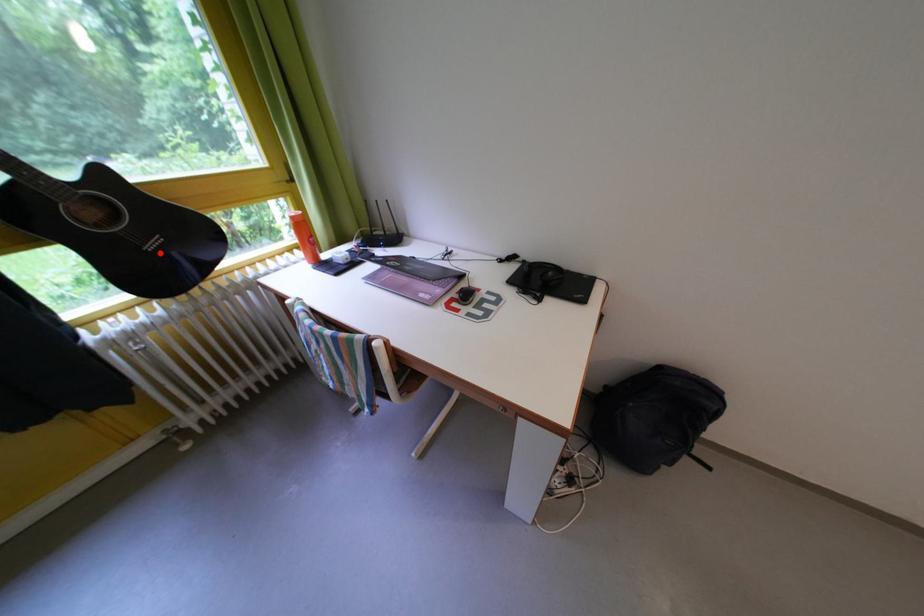
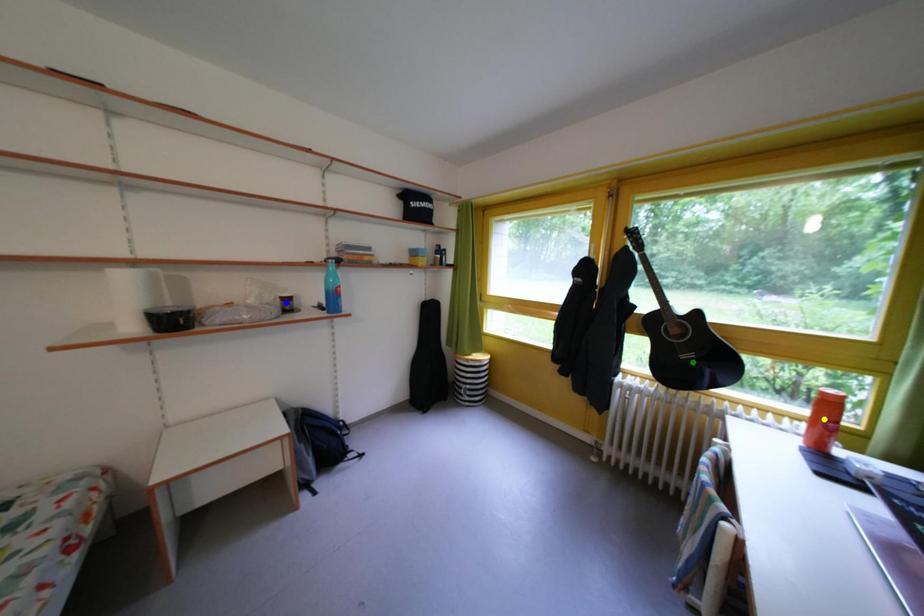
Question: I am providing you with two images of the same scene from different viewpoints. A red point is marked on the first image. You are given multiple points on the second image. Which point in image 2 represents the same 3d spot as the red point in image 1?

Choices:
 (A) yellow point
 (B) blue point
 (C) green point

Answer: (C)